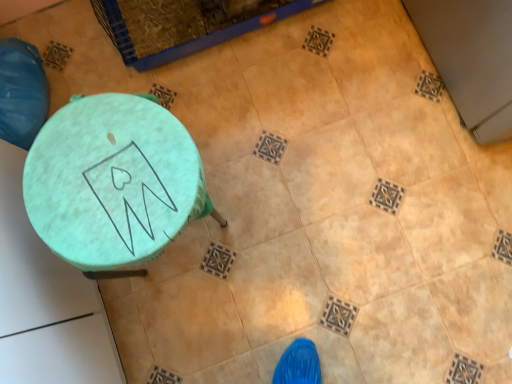
What is the approximate width of teal fabric-covered stool at lower left?

The width of teal fabric-covered stool at lower left is 32.71 centimeters.

The image size is (512, 384). What do you see at coordinates (113, 181) in the screenshot?
I see `teal fabric-covered stool at lower left` at bounding box center [113, 181].

Where is `teal fabric-covered stool at lower left`? This screenshot has height=384, width=512. teal fabric-covered stool at lower left is located at coordinates (113, 181).

The width and height of the screenshot is (512, 384). Find the location of `teal fabric-covered stool at lower left`. teal fabric-covered stool at lower left is located at coordinates (113, 181).